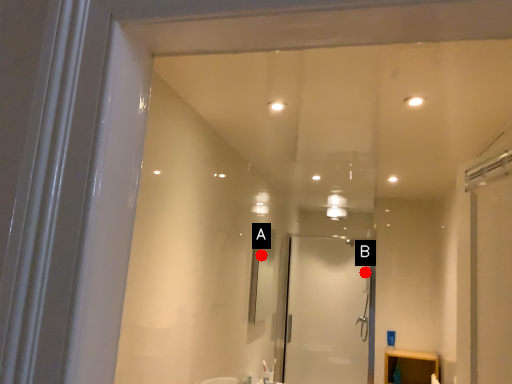
Question: Two points are circled on the image, labeled by A and B beside each circle. Which point is closer to the camera?

Choices:
 (A) A is closer
 (B) B is closer

Answer: (A)